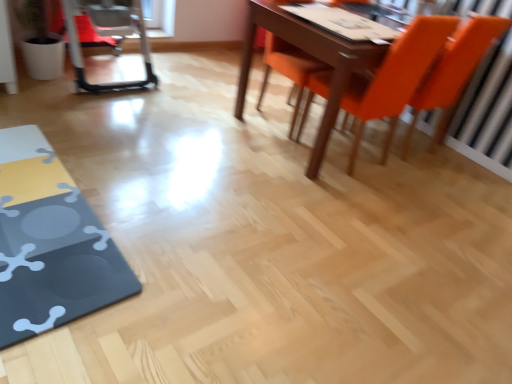
In order to click on free location to the right of metallic silver swivel chair at left in this screenshot , I will do `click(188, 90)`.